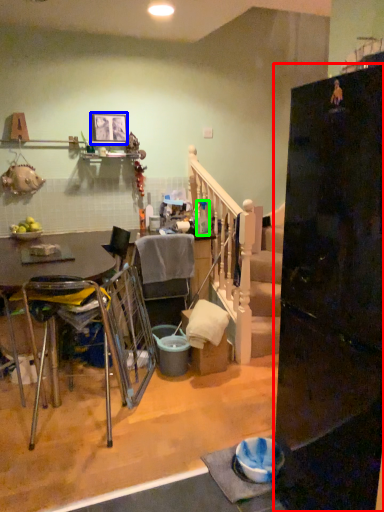
Question: Which object is positioned closest to refrigerator (highlighted by a red box)? Select from picture frame (highlighted by a blue box) and bottle (highlighted by a green box).

Choices:
 (A) picture frame
 (B) bottle

Answer: (B)